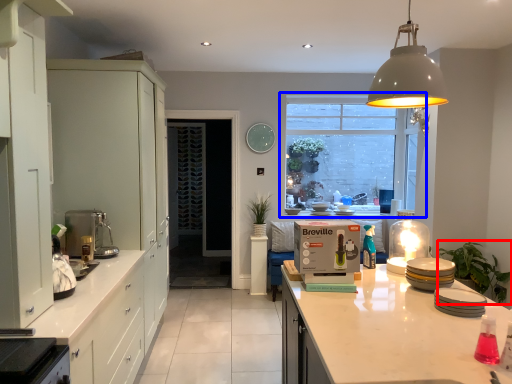
Question: Among these objects, which one is nearest to the camera, plant (highlighted by a red box) or window (highlighted by a blue box)?

Choices:
 (A) plant
 (B) window

Answer: (A)